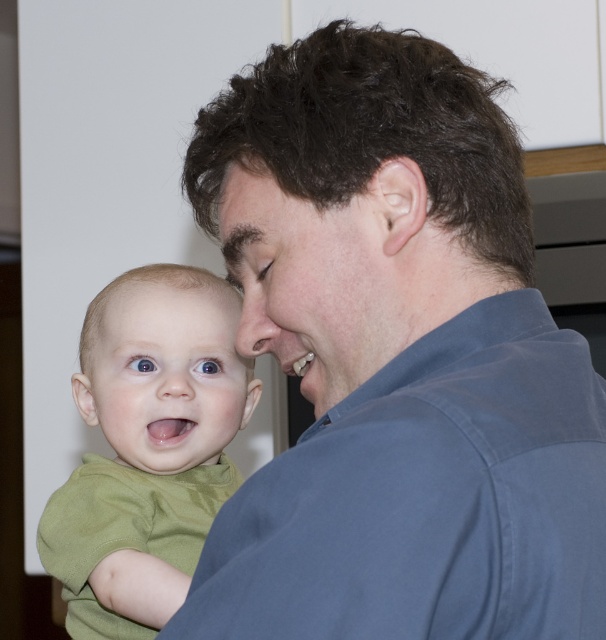
You are a photographer trying to capture a closeup of the baby in this scene. You need to ensure that both the blue cotton shirt at upper right and the smooth green baby face at center are visible in the frame. Based on their positions, which side of the baby should you position the camera to get both objects in view?

The blue cotton shirt at upper right is positioned on the right side of the smooth green baby face at center. To include both in the frame, position the camera to the right side of the baby so that the shirt and the baby face are both visible.

In the scene where an adult and a baby are sharing a tender moment, you notice the blue cotton shirt at upper right and the smooth skin face at center. Which object takes up more space in the image?

The blue cotton shirt at upper right has a larger size compared to the smooth skin face at center, so it takes up more space in the image.